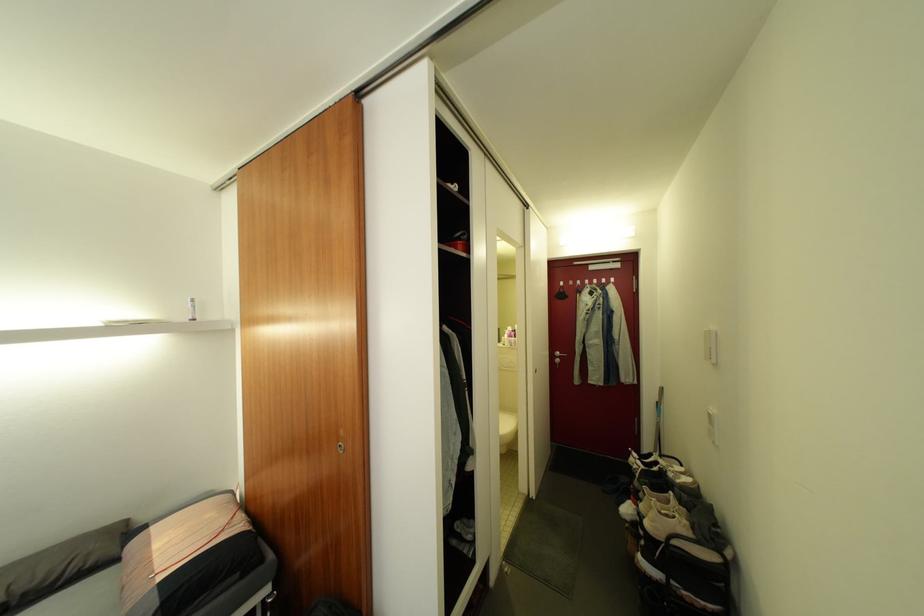
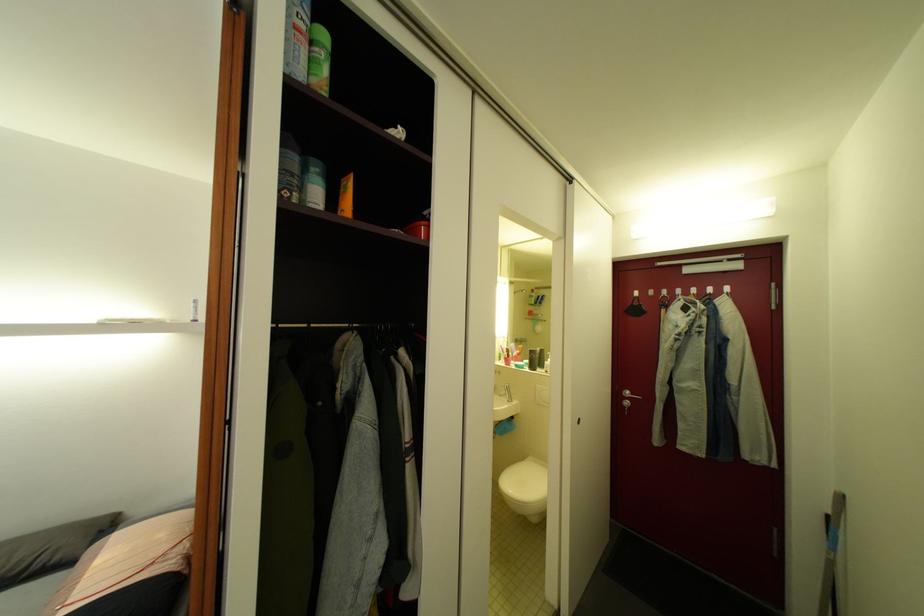
Question: The camera is either moving clockwise (left) or counter-clockwise (right) around the object. The first image is from the beginning of the video and the second image is from the end. Is the camera moving left or right when shooting the video?

Choices:
 (A) Left
 (B) Right

Answer: (B)